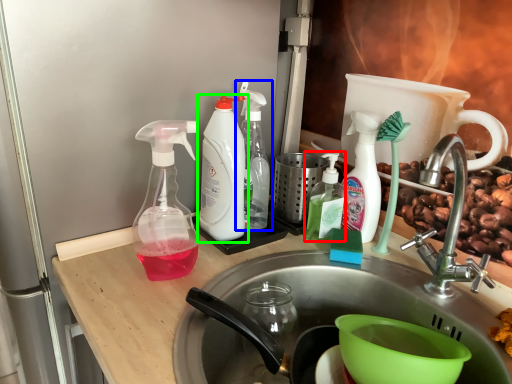
Question: Considering the real-world distances, which object is farthest from bottle (highlighted by a red box)? bottle (highlighted by a blue box) or bottle (highlighted by a green box)?

Choices:
 (A) bottle
 (B) bottle

Answer: (B)